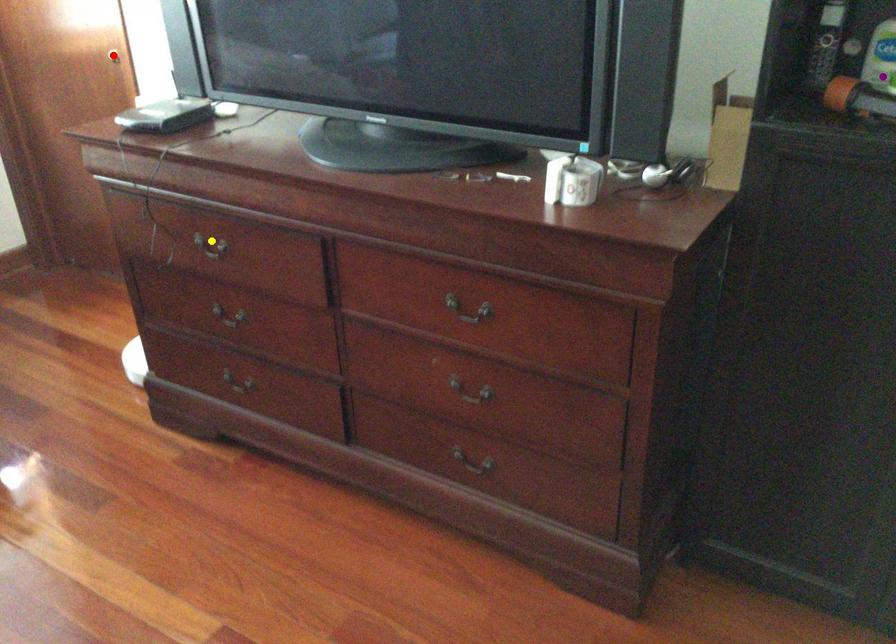
Based on the photo, order these from farthest to nearest:
- purple point
- red point
- yellow point

red point < yellow point < purple point